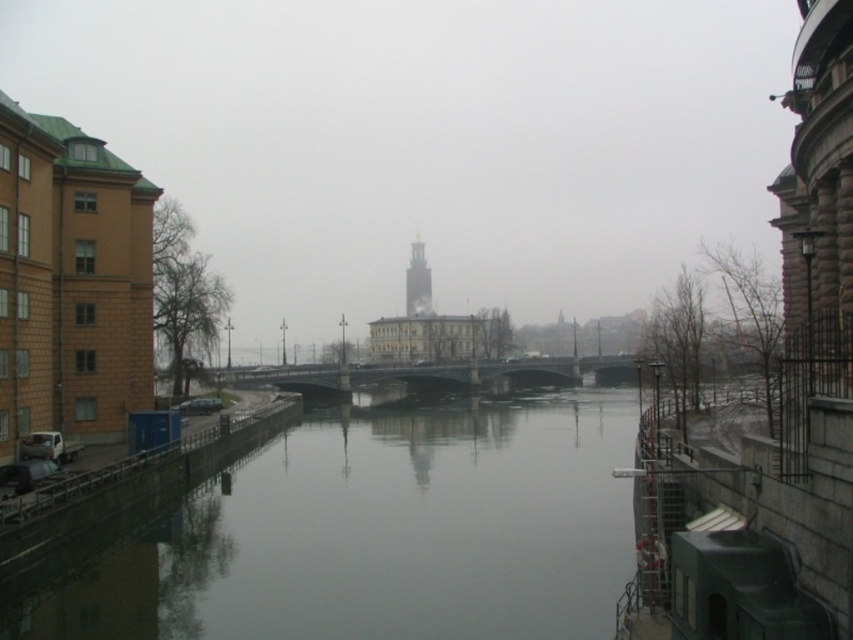
Question: Is smooth concrete river at center behind gold textured tower at center?

Choices:
 (A) no
 (B) yes

Answer: (A)

Question: Is smooth concrete river at center closer to the viewer compared to gold textured tower at center?

Choices:
 (A) yes
 (B) no

Answer: (A)

Question: Is dark gray concrete bridge at center to the left of gold textured tower at center from the viewer's perspective?

Choices:
 (A) no
 (B) yes

Answer: (A)

Question: Considering the real-world distances, which object is farthest from the gold textured tower at center?

Choices:
 (A) smooth concrete river at center
 (B) dark gray concrete bridge at center

Answer: (A)

Question: Considering the real-world distances, which object is farthest from the smooth concrete river at center?

Choices:
 (A) dark gray concrete bridge at center
 (B) gold textured tower at center

Answer: (B)

Question: Among these objects, which one is nearest to the camera?

Choices:
 (A) smooth concrete river at center
 (B) gold textured tower at center
 (C) dark gray concrete bridge at center

Answer: (A)